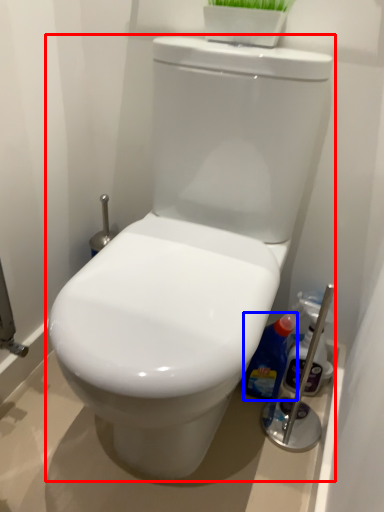
Question: Which object is closer to the camera taking this photo, toilet (highlighted by a red box) or cleaning product (highlighted by a blue box)?

Choices:
 (A) toilet
 (B) cleaning product

Answer: (A)